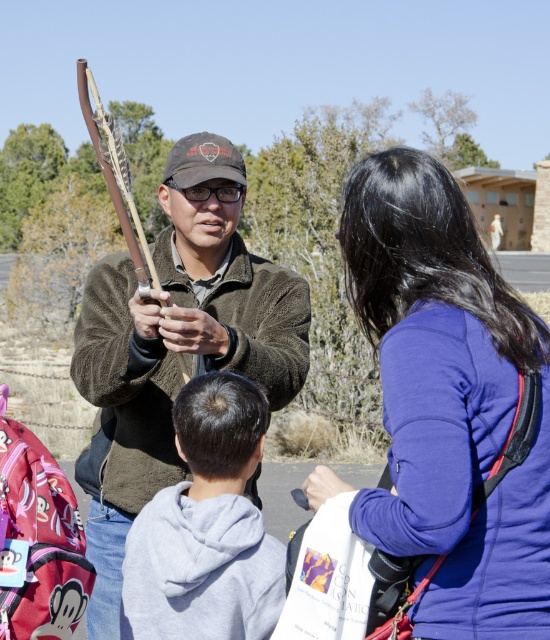
Question: Among these points, which one is farthest from the camera?

Choices:
 (A) (305, 348)
 (B) (469, 337)

Answer: (A)

Question: Which object is the closest to the gray fleece hoodie at lower center?

Choices:
 (A) wooden bow at center
 (B) dark brown fuzzy jacket at center

Answer: (B)

Question: Does dark brown fuzzy jacket at center have a lesser width compared to wooden bow at center?

Choices:
 (A) yes
 (B) no

Answer: (A)

Question: Which point is closer to the camera?

Choices:
 (A) tap(166, 401)
 (B) tap(107, 166)

Answer: (B)

Question: Is purple fleece jacket at upper right behind wooden bow at center?

Choices:
 (A) no
 (B) yes

Answer: (A)

Question: Does dark brown fuzzy jacket at center appear over wooden bow at center?

Choices:
 (A) yes
 (B) no

Answer: (B)